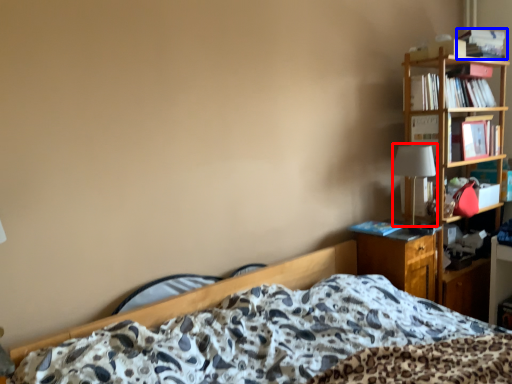
Question: Which object appears closest to the camera in this image, table lamp (highlighted by a red box) or book (highlighted by a blue box)?

Choices:
 (A) table lamp
 (B) book

Answer: (A)